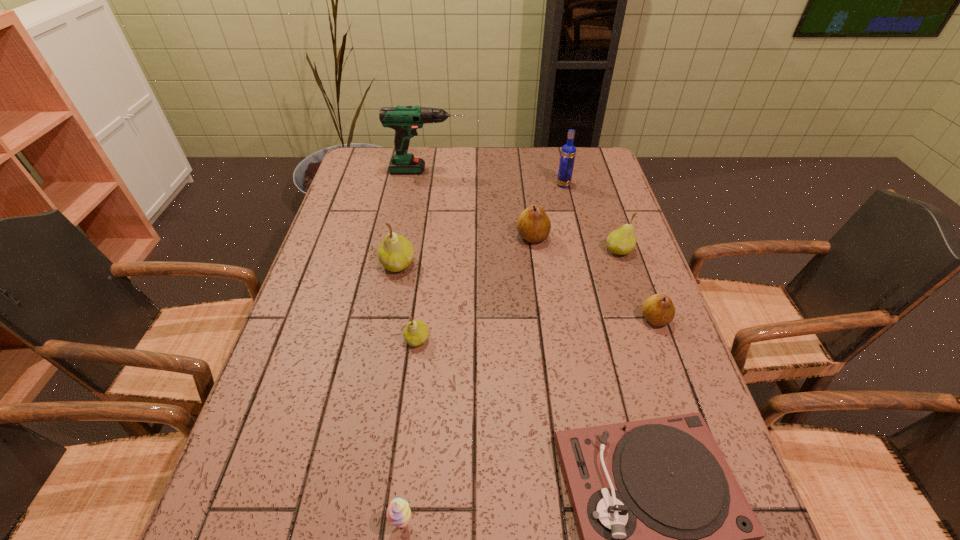
Find the location of a particular element. The image size is (960, 540). drill is located at coordinates (405, 120).

This screenshot has height=540, width=960. In order to click on the tallest object in this screenshot , I will do `click(405, 120)`.

Locate an element on the screen. The width and height of the screenshot is (960, 540). blue vodka is located at coordinates (568, 152).

Find the location of a particular element. This screenshot has height=540, width=960. vodka is located at coordinates (x=568, y=152).

Image resolution: width=960 pixels, height=540 pixels. In order to click on the biggest green pear in this screenshot , I will do `click(395, 252)`.

You are a GUI agent. You are given a task and a screenshot of the screen. Output one action in this format:
    pyautogui.click(x=<x>, y=<y>)
    Task: Click on the leftmost green pear
    The height and width of the screenshot is (540, 960).
    Given the screenshot: What is the action you would take?
    pyautogui.click(x=395, y=252)

Identify the location of the bigger brown pear. (533, 225).

At what (x,y) coordinates should I click in order to perform the action: click on the farther brown pear. Please return your answer as a coordinate pair (x, y). The image size is (960, 540). Looking at the image, I should click on (533, 225).

Identify the location of the second smallest green pear. The width and height of the screenshot is (960, 540). click(622, 241).

I want to click on the smaller brown pear, so click(658, 309).